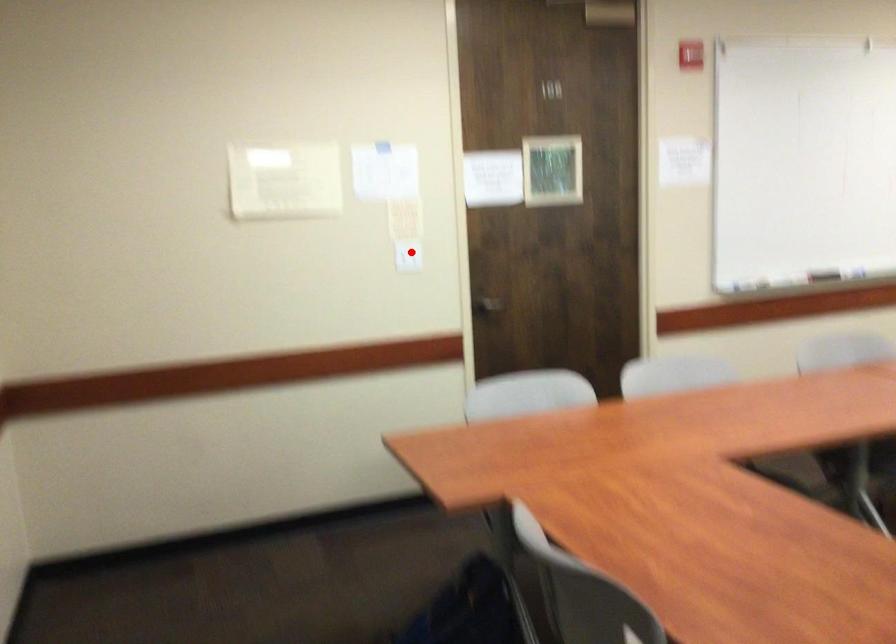
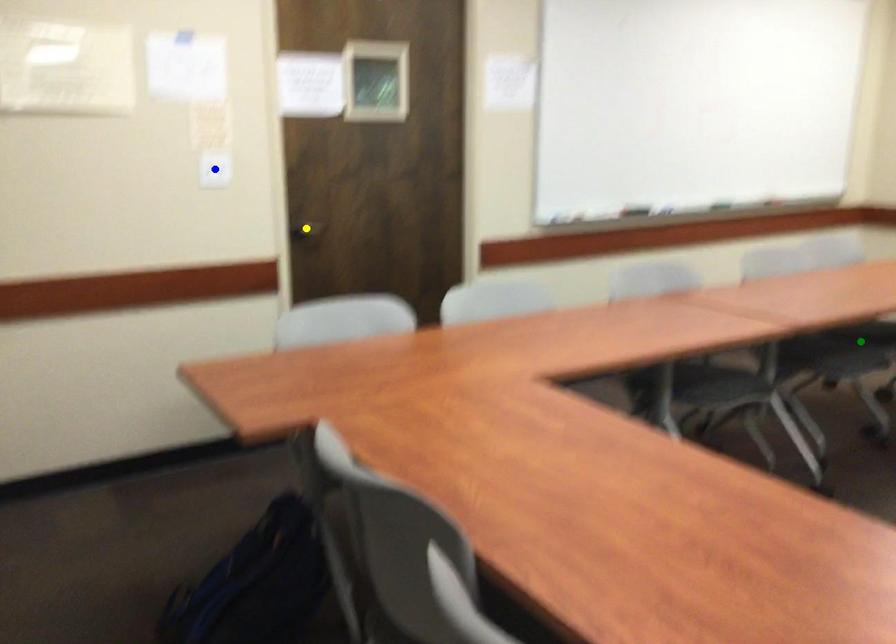
Question: I am providing you with two images of the same scene from different viewpoints. A red point is marked on the first image. You are given multiple points on the second image. Which point in image 2 represents the same 3d spot as the red point in image 1?

Choices:
 (A) yellow point
 (B) green point
 (C) blue point

Answer: (C)